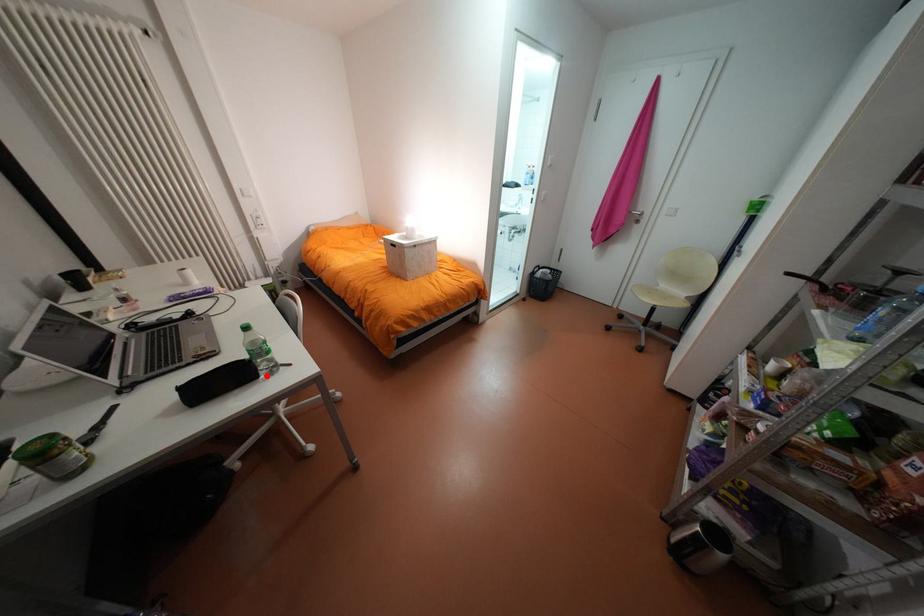
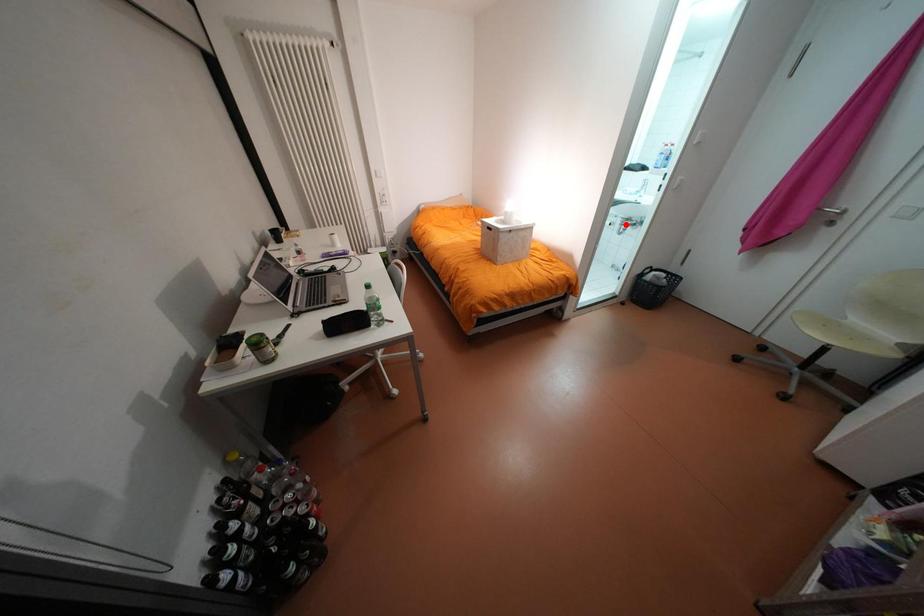
I am providing you with two images of the same scene from different viewpoints. A red point is marked on the first image and another point is marked on the second image. Are the points marked in image1 and image2 representing the same 3D position?

No